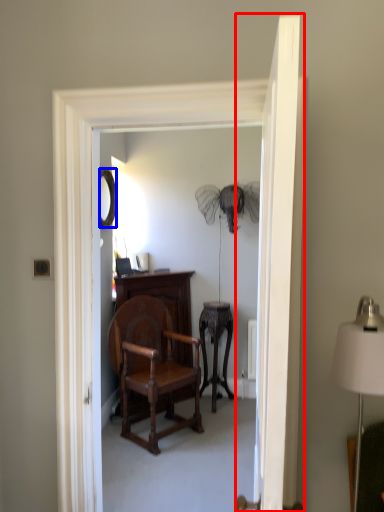
Question: Which point is closer to the camera, door (highlighted by a red box) or mirror (highlighted by a blue box)?

Choices:
 (A) door
 (B) mirror

Answer: (A)